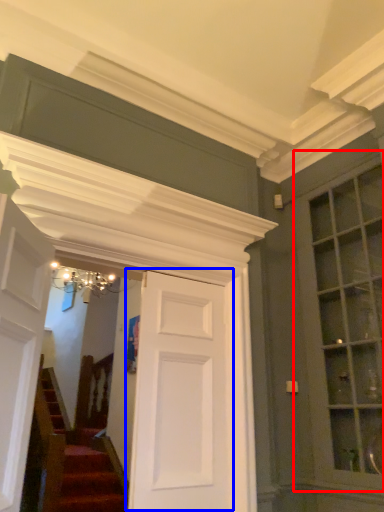
Question: Which of the following is the closest to the observer, window (highlighted by a red box) or door (highlighted by a blue box)?

Choices:
 (A) window
 (B) door

Answer: (B)